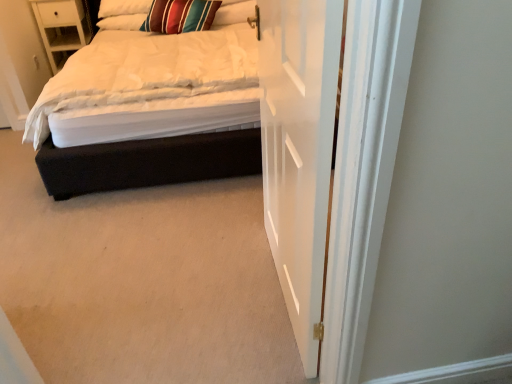
Question: Is white wood nightstand at upper left oriented towards white wooden door at center?

Choices:
 (A) yes
 (B) no

Answer: (B)

Question: Is there a large distance between white wood nightstand at upper left and white wooden door at center?

Choices:
 (A) no
 (B) yes

Answer: (B)

Question: Would you say white wooden door at center is part of white wood nightstand at upper left's contents?

Choices:
 (A) yes
 (B) no

Answer: (B)

Question: Is white wood nightstand at upper left positioned before white wooden door at center?

Choices:
 (A) no
 (B) yes

Answer: (A)

Question: Considering the relative sizes of white wood nightstand at upper left and white wooden door at center in the image provided, is white wood nightstand at upper left taller than white wooden door at center?

Choices:
 (A) yes
 (B) no

Answer: (B)

Question: From the image's perspective, is white wood nightstand at upper left below white wooden door at center?

Choices:
 (A) no
 (B) yes

Answer: (A)

Question: Can you confirm if velvet black bed at center is bigger than striped fabric pillow at upper center, which ranks as the 1th pillow in right-to-left order?

Choices:
 (A) yes
 (B) no

Answer: (A)

Question: Is the position of velvet black bed at center more distant than that of striped fabric pillow at upper center, the 2th pillow from the left?

Choices:
 (A) yes
 (B) no

Answer: (B)

Question: Can you confirm if velvet black bed at center is taller than striped fabric pillow at upper center, the 2th pillow from the left?

Choices:
 (A) yes
 (B) no

Answer: (A)

Question: Is velvet black bed at center at the left side of striped fabric pillow at upper center, which ranks as the 1th pillow in right-to-left order?

Choices:
 (A) no
 (B) yes

Answer: (B)

Question: From the image's perspective, is velvet black bed at center located above striped fabric pillow at upper center, which ranks as the 1th pillow in right-to-left order?

Choices:
 (A) yes
 (B) no

Answer: (B)

Question: Is velvet black bed at center not near striped fabric pillow at upper center, which ranks as the 1th pillow in right-to-left order?

Choices:
 (A) yes
 (B) no

Answer: (A)

Question: Is striped fabric pillow at upper center, which ranks as the 1th pillow in right-to-left order, aimed at white wood nightstand at upper left?

Choices:
 (A) no
 (B) yes

Answer: (A)